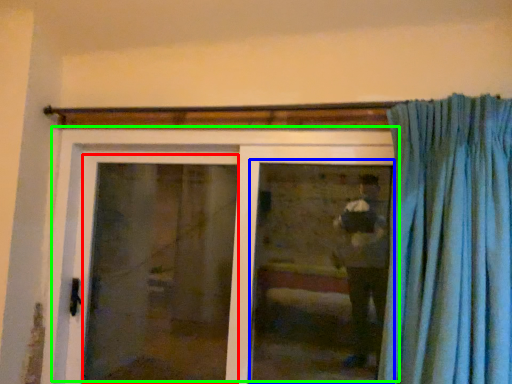
Question: Considering the real-world distances, which object is closest to screen door (highlighted by a red box)? window (highlighted by a blue box) or door (highlighted by a green box).

Choices:
 (A) window
 (B) door

Answer: (B)